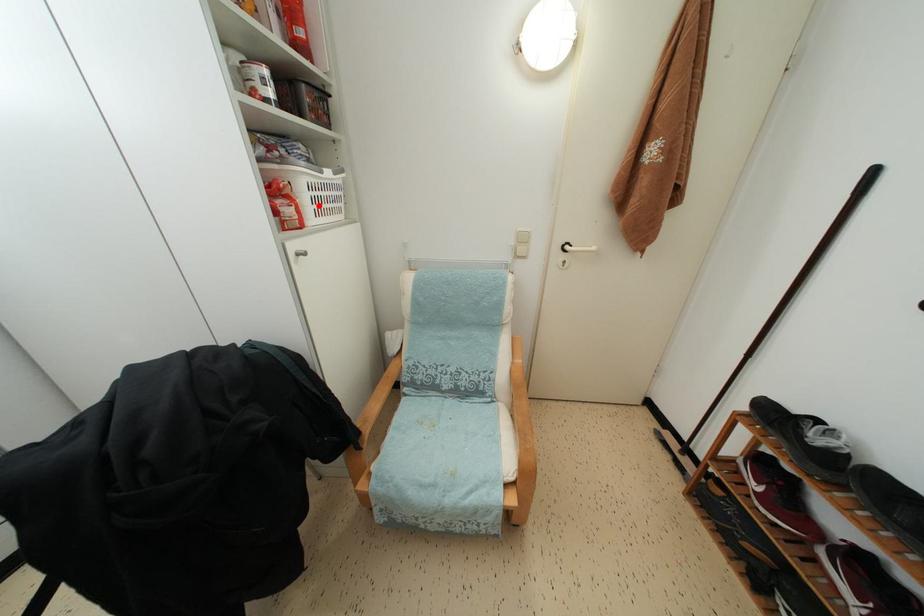
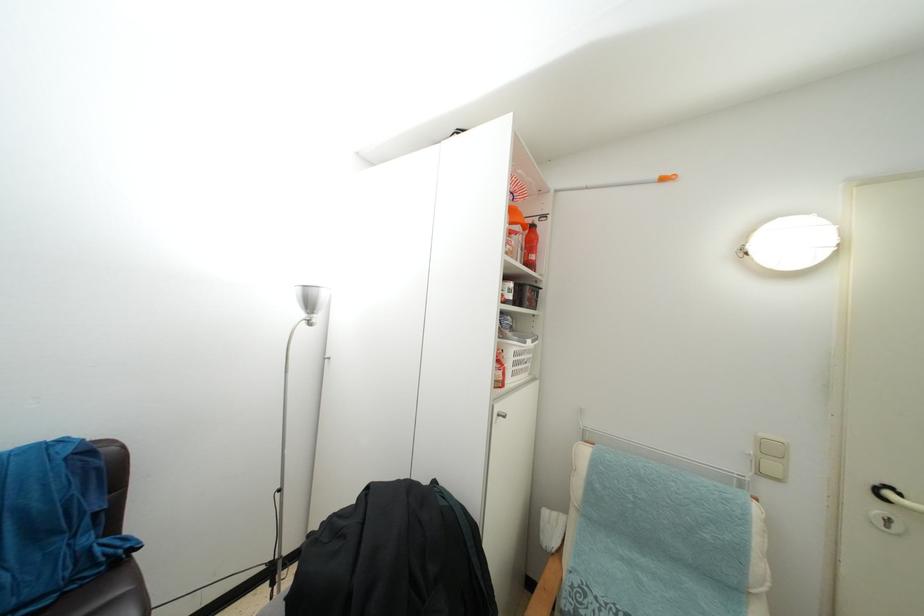
Find the pixel in the second image that matches the highlighted location in the first image.

(519, 370)